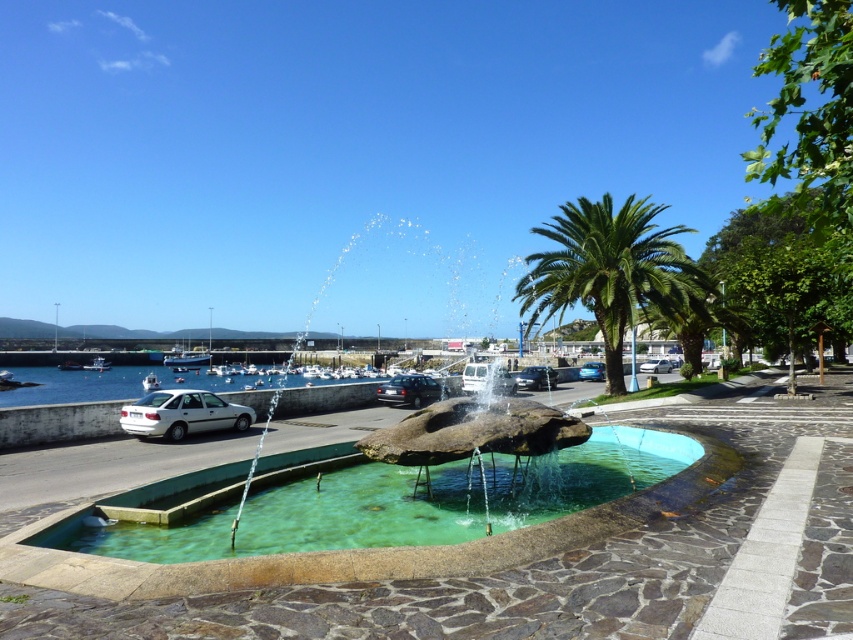
You are standing in the outdoor scene and want to take a photo of the green stone fountain at center. If your camera has a maximum focus range of 5 meters, will it be able to capture the fountain clearly?

The green stone fountain at center is 4.73 meters away from the camera, which is within the 5 meters maximum focus range. Therefore, the camera can capture the fountain clearly.

Consider the image. You are standing at the fountain basin and want to reach the point marked at coordinates (432,438). How far will you have to walk to get there?

The point at coordinates (432,438) is 7.61 meters away from the viewer, so you will have to walk 7.61 meters to reach it.

You are a delivery person who needs to drive a truck that is 1.8 meters tall through a narrow alleyway. The alleyway has a low clearance marked by the height of the matte silver sedan at center. Can your truck pass under the clearance without hitting the white plastic boat at left?

The matte silver sedan at center has a lesser height compared to the white plastic boat at left. Since the truck is 1.8 meters tall and the sedan is shorter than the boat, the truck can pass under the clearance marked by the sedan without hitting the boat.